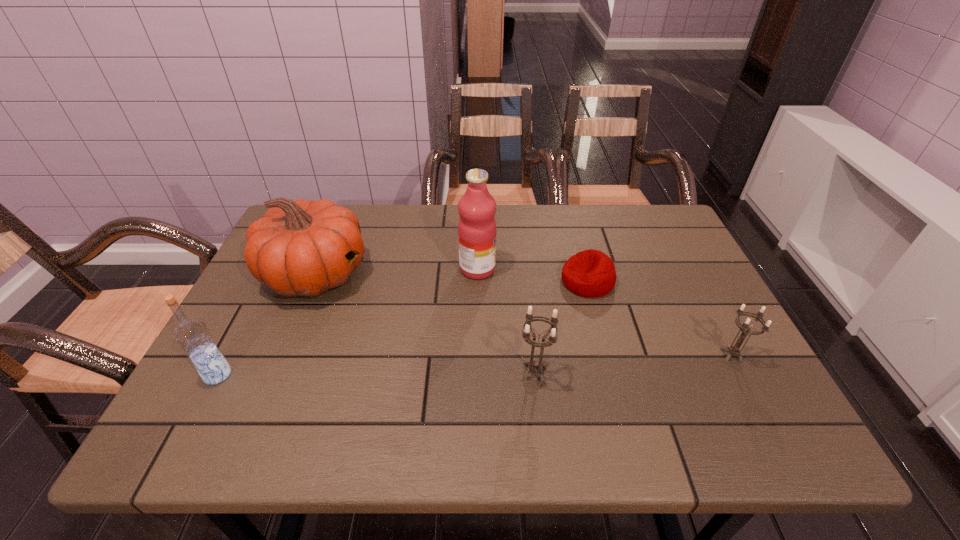
The height and width of the screenshot is (540, 960). Identify the location of blank space located on the right of the taller candle holder. (706, 374).

The image size is (960, 540). What are the coordinates of `vacant space located 0.240m on the back of the rightmost object` in the screenshot? It's located at [689, 276].

Identify the location of free space located 0.240m on the face of the pumpkin. (459, 274).

At what (x,y) coordinates should I click in order to perform the action: click on vacant space located 0.070m on the label of the fourth object from right to left. Please return your answer as a coordinate pair (x, y). Image resolution: width=960 pixels, height=540 pixels. Looking at the image, I should click on 521,269.

The image size is (960, 540). Find the location of `vacant space situated on the seat area of the beanbag`. vacant space situated on the seat area of the beanbag is located at coordinates (452, 281).

The image size is (960, 540). Identify the location of free space located 0.100m on the seat area of the beanbag. (523, 281).

In order to click on free location located 0.340m on the seat area of the beanbag in this screenshot , I will do `click(433, 281)`.

Image resolution: width=960 pixels, height=540 pixels. Find the location of `vacant space located on the right of the vodka`. vacant space located on the right of the vodka is located at coordinates (375, 375).

At what (x,y) coordinates should I click in order to perform the action: click on object located at the far edge. Please return your answer as a coordinate pair (x, y). Looking at the image, I should click on (298, 248).

Image resolution: width=960 pixels, height=540 pixels. I want to click on candle holder present at the near edge, so click(x=534, y=366).